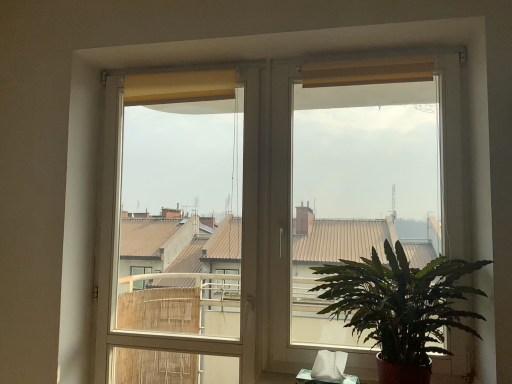
Question: From a real-world perspective, does matte yellow screen at right stand above green leafy plant at lower right?

Choices:
 (A) no
 (B) yes

Answer: (B)

Question: Is matte yellow screen at right taller than green leafy plant at lower right?

Choices:
 (A) yes
 (B) no

Answer: (A)

Question: Is matte yellow screen at right completely or partially outside of green leafy plant at lower right?

Choices:
 (A) no
 (B) yes

Answer: (B)

Question: Is matte yellow screen at right at the right side of green leafy plant at lower right?

Choices:
 (A) yes
 (B) no

Answer: (B)

Question: Is green leafy plant at lower right located within matte yellow screen at right?

Choices:
 (A) yes
 (B) no

Answer: (B)

Question: Considering the positions of point (418, 362) and point (185, 89), is point (418, 362) closer or farther from the camera than point (185, 89)?

Choices:
 (A) farther
 (B) closer

Answer: (B)

Question: Is green leafy plant at lower right bigger or smaller than white plastic window frame at center?

Choices:
 (A) big
 (B) small

Answer: (B)

Question: Would you say green leafy plant at lower right is inside or outside white plastic window frame at center?

Choices:
 (A) inside
 (B) outside

Answer: (B)

Question: From a real-world perspective, is green leafy plant at lower right physically located above or below white plastic window frame at center?

Choices:
 (A) above
 (B) below

Answer: (B)

Question: From a real-world perspective, relative to matte yellow screen at right, is white plastic window frame at center vertically above or below?

Choices:
 (A) above
 (B) below

Answer: (B)

Question: In terms of height, does white plastic window frame at center look taller or shorter compared to matte yellow screen at right?

Choices:
 (A) short
 (B) tall

Answer: (B)

Question: Visually, is white plastic window frame at center positioned to the left or to the right of matte yellow screen at right?

Choices:
 (A) right
 (B) left

Answer: (B)

Question: Is white plastic window frame at center inside the boundaries of matte yellow screen at right, or outside?

Choices:
 (A) inside
 (B) outside

Answer: (B)

Question: Looking at their shapes, would you say matte yellow screen at right is wider or thinner than white plastic window frame at center?

Choices:
 (A) wide
 (B) thin

Answer: (B)

Question: Which is correct: matte yellow screen at right is inside white plastic window frame at center, or outside of it?

Choices:
 (A) outside
 (B) inside

Answer: (A)